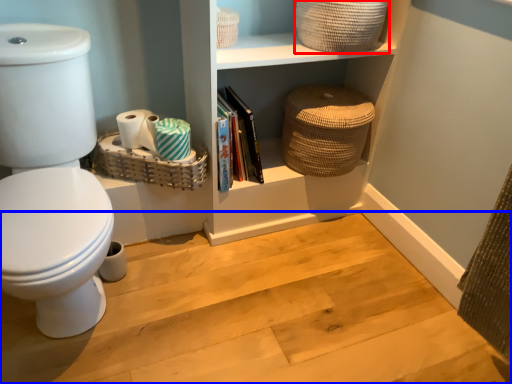
Question: Which object appears closest to the camera in this image, basket (highlighted by a red box) or stair (highlighted by a blue box)?

Choices:
 (A) basket
 (B) stair

Answer: (B)